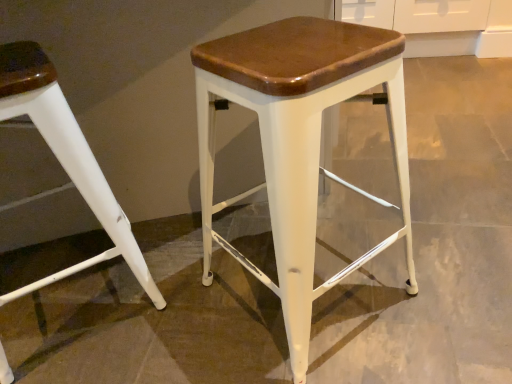
Find the location of a particular element. The height and width of the screenshot is (384, 512). free space above matte white stool at center, acting as the first stool starting from the right (from a real-world perspective) is located at coordinates (290, 44).